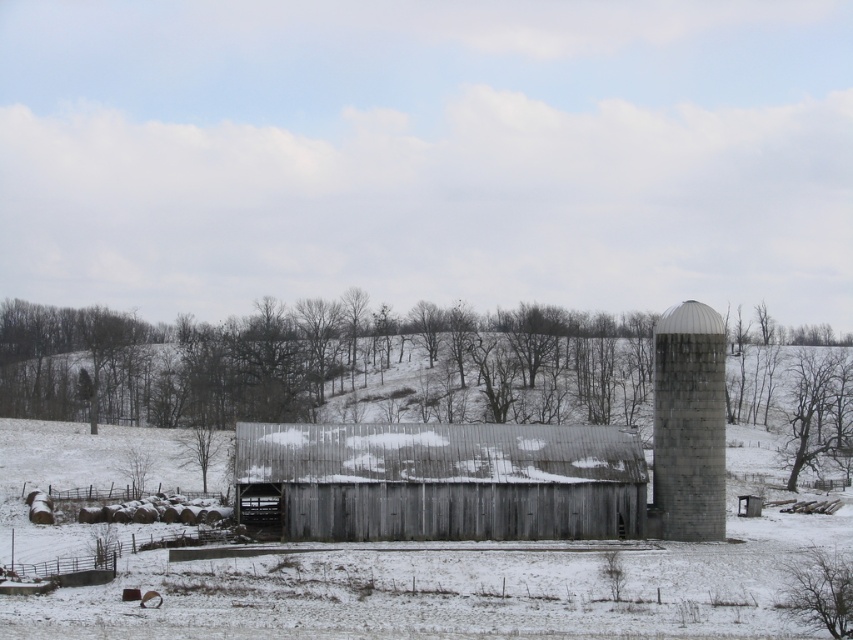
Question: Is weathered wood barn at center below gray concrete silo at right?

Choices:
 (A) yes
 (B) no

Answer: (A)

Question: Is weathered wood barn at center to the right of gray concrete silo at right from the viewer's perspective?

Choices:
 (A) no
 (B) yes

Answer: (A)

Question: Which point appears farthest from the camera in this image?

Choices:
 (A) (669, 340)
 (B) (399, 504)

Answer: (A)

Question: Is weathered wood barn at center bigger than gray concrete silo at right?

Choices:
 (A) yes
 (B) no

Answer: (A)

Question: Which of the following is the closest to the observer?

Choices:
 (A) (660, 390)
 (B) (305, 472)

Answer: (B)